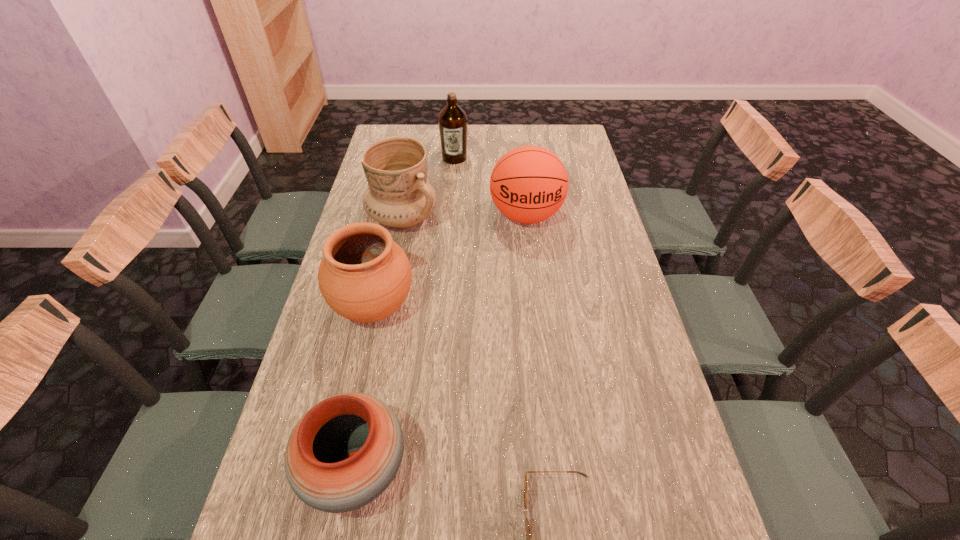
Where is `the farthest object`? the farthest object is located at coordinates (452, 121).

The width and height of the screenshot is (960, 540). I want to click on the farthest pottery, so [399, 196].

At what (x,y) coordinates should I click in order to perform the action: click on basketball. Please return your answer as a coordinate pair (x, y). Looking at the image, I should click on (529, 184).

Where is `the third nearest object`? The image size is (960, 540). the third nearest object is located at coordinates click(364, 276).

Locate an element on the screen. Image resolution: width=960 pixels, height=540 pixels. the shortest pottery is located at coordinates (344, 452).

This screenshot has width=960, height=540. I want to click on the nearest pottery, so click(344, 452).

At what (x,y) coordinates should I click in order to perform the action: click on vacant space located 0.100m on the label of the farthest object. Please return your answer as a coordinate pair (x, y). Looking at the image, I should click on (453, 180).

Locate an element on the screen. vacant space located 0.230m on the back of the farthest pottery is located at coordinates (414, 164).

Locate an element on the screen. The image size is (960, 540). vacant area situated 0.330m on the side with logo of the basketball is located at coordinates (538, 319).

The image size is (960, 540). I want to click on free space located 0.060m on the front of the second nearest pottery, so (x=362, y=362).